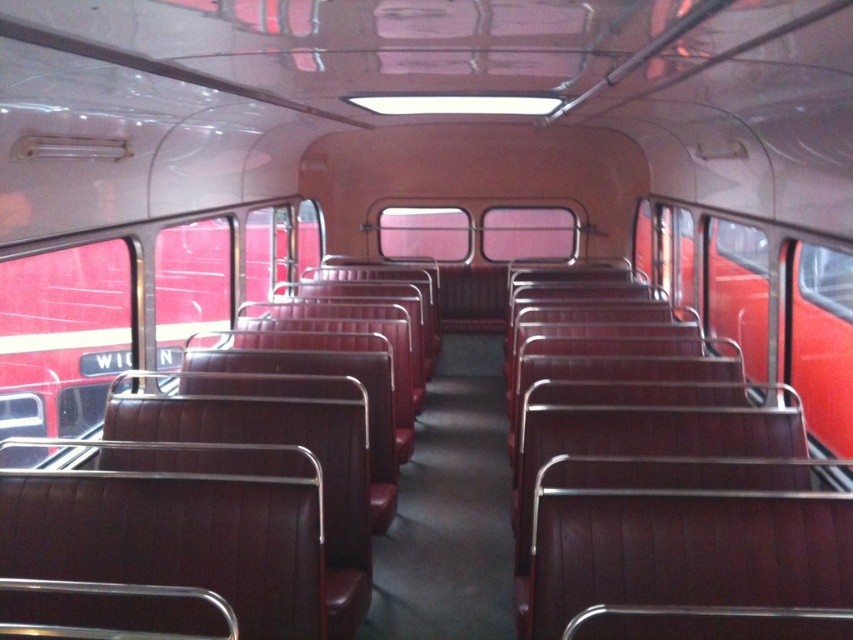
Can you confirm if leather-like maroon seats at left is positioned to the left of transparent glass window at center?

Yes, leather-like maroon seats at left is to the left of transparent glass window at center.

Can you confirm if leather-like maroon seats at left is bigger than transparent glass window at center?

Yes, leather-like maroon seats at left is bigger than transparent glass window at center.

Which is in front, point (82, 275) or point (397, 230)?

Point (82, 275) is in front.

Where is `leather-like maroon seats at left`? leather-like maroon seats at left is located at coordinates (120, 310).

Does leather-like maroon seats at left appear under transparent glass window at upper right?

Yes.

Is point (68, 368) in front of point (756, 257)?

No, (68, 368) is behind (756, 257).

Where is `leather-like maroon seats at left`? leather-like maroon seats at left is located at coordinates (120, 310).

Locate an element on the screen. This screenshot has width=853, height=640. leather-like maroon seats at left is located at coordinates (120, 310).

Looking at this image, who is positioned more to the right, matte glass window at center or transparent glass window at center?

matte glass window at center is more to the right.

Between matte glass window at center and transparent glass window at center, which one has more height?

matte glass window at center is taller.

Who is more forward, (549, 211) or (392, 253)?

Point (549, 211) is in front.

You are a GUI agent. You are given a task and a screenshot of the screen. Output one action in this format:
    pyautogui.click(x=<x>, y=<y>)
    Task: Click on the matte glass window at center
    This screenshot has height=640, width=853.
    Given the screenshot: What is the action you would take?
    pyautogui.click(x=527, y=234)